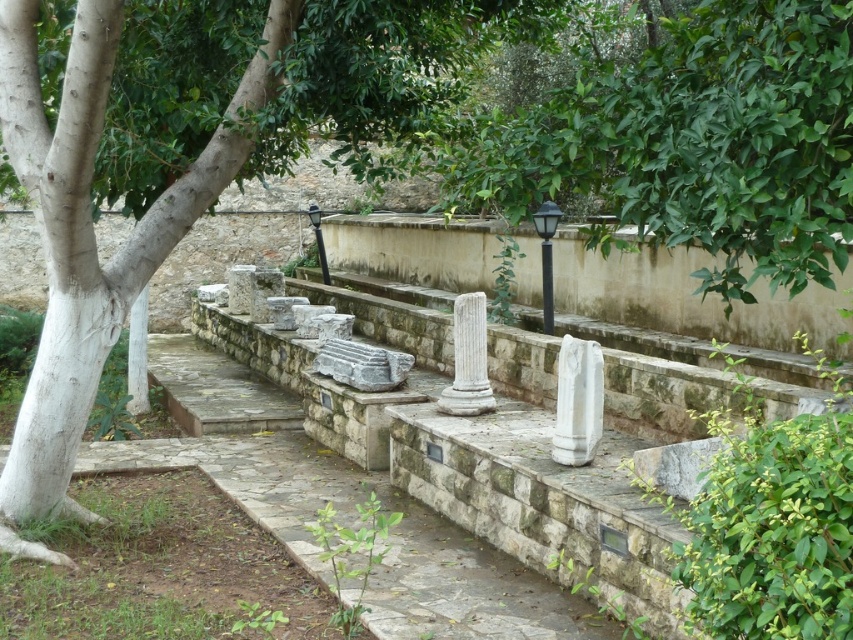
Who is shorter, green leafy tree at center or white marble pillar at lower left?

Standing shorter between the two is white marble pillar at lower left.

Can you confirm if green leafy tree at center is wider than white marble pillar at lower left?

Correct, the width of green leafy tree at center exceeds that of white marble pillar at lower left.

Where is `green leafy tree at center`? The image size is (853, 640). green leafy tree at center is located at coordinates (190, 150).

The width and height of the screenshot is (853, 640). Identify the location of green leafy tree at center. (190, 150).

Between white marble column at center and white marble pillar at lower left, which one is positioned higher?

white marble pillar at lower left

Who is lower down, white marble column at center or white marble pillar at lower left?

white marble column at center is lower down.

Measure the distance between white marble column at center and camera.

white marble column at center and camera are 6.84 meters apart.

Find the location of a particular element. This screenshot has height=640, width=853. white marble column at center is located at coordinates (468, 358).

Does white marble pillar at center have a greater height compared to white marble pillar at lower left?

No, white marble pillar at center is not taller than white marble pillar at lower left.

Who is shorter, white marble pillar at center or white marble pillar at lower left?

white marble pillar at center

Which is in front, point (592, 380) or point (128, 348)?

Point (592, 380) is in front.

Locate an element on the screen. This screenshot has height=640, width=853. white marble pillar at center is located at coordinates (577, 401).